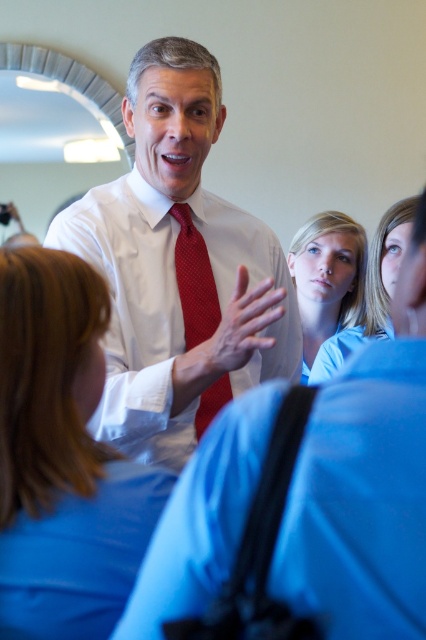
Question: Is white smooth shirt at center smaller than red textured tie at center?

Choices:
 (A) no
 (B) yes

Answer: (A)

Question: Is the position of blonde hair at center more distant than that of smooth blue shirt at center?

Choices:
 (A) yes
 (B) no

Answer: (B)

Question: Which point is closer to the camera?

Choices:
 (A) (411, 221)
 (B) (247, 330)

Answer: (B)

Question: Which of the following is the farthest from the observer?

Choices:
 (A) white smooth shirt at center
 (B) red textured tie at center
 (C) blonde hair at center
 (D) blue fabric shirt at center

Answer: (B)

Question: Among these objects, which one is nearest to the camera?

Choices:
 (A) white smooth shirt at center
 (B) blue fabric shirt at upper center

Answer: (A)

Question: Can you confirm if blonde hair at center is positioned to the left of smooth blue shirt at center?

Choices:
 (A) no
 (B) yes

Answer: (B)